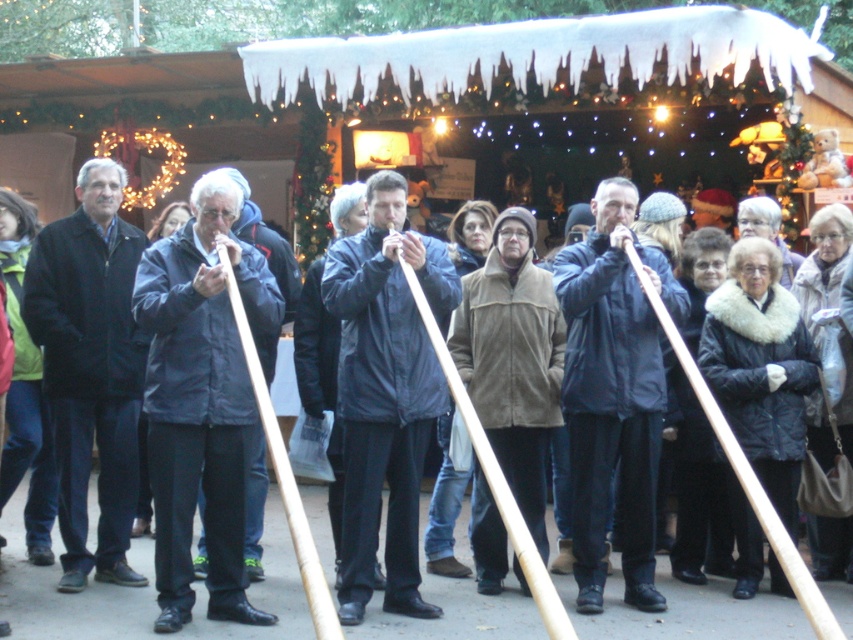
Question: Which object appears farthest from the camera in this image?

Choices:
 (A) brown suede jacket at center
 (B) dark blue jacket at center

Answer: (A)

Question: Can you confirm if dark blue jacket at center is positioned to the left of brown suede jacket at center?

Choices:
 (A) yes
 (B) no

Answer: (A)

Question: Does dark blue jacket at center appear on the left side of brown suede jacket at center?

Choices:
 (A) no
 (B) yes

Answer: (B)

Question: Is dark blue jacket at center wider than brown suede jacket at center?

Choices:
 (A) no
 (B) yes

Answer: (B)

Question: Which of the following is the closest to the observer?

Choices:
 (A) dark blue jacket at center
 (B) brown suede jacket at center

Answer: (A)